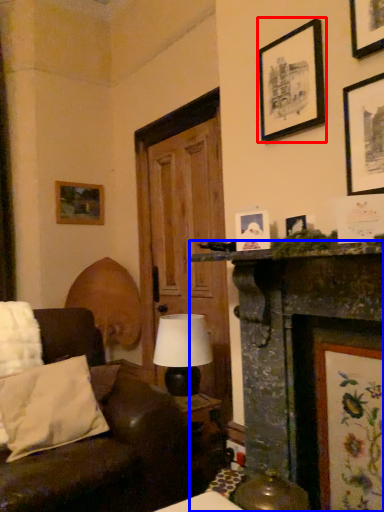
Question: Which point is closer to the camera, picture frame (highlighted by a red box) or fireplace (highlighted by a blue box)?

Choices:
 (A) picture frame
 (B) fireplace

Answer: (B)